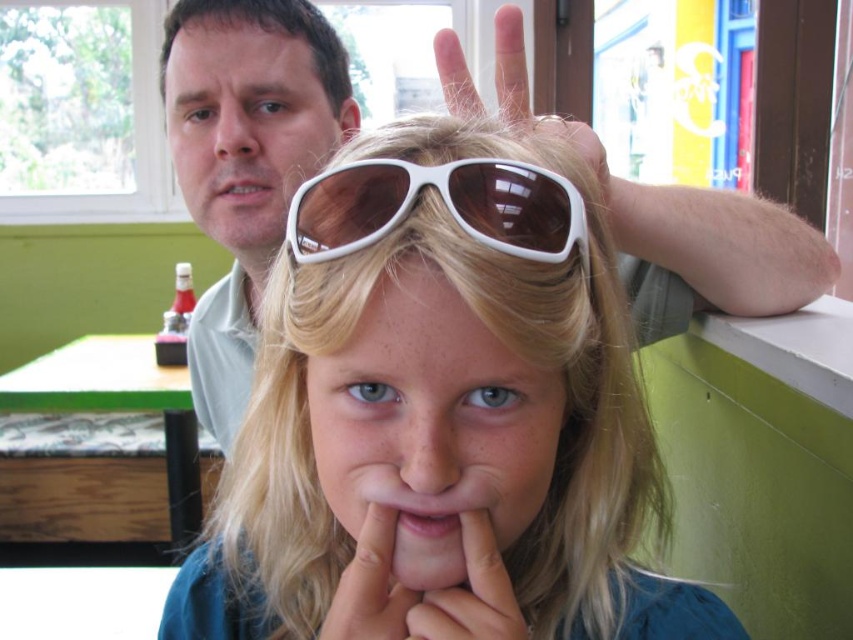
Question: Does white plastic sunglasses at center lie in front of matte skin nose at upper center?

Choices:
 (A) no
 (B) yes

Answer: (B)

Question: Is white matte hand at center wider than matte skin mouth at upper center?

Choices:
 (A) no
 (B) yes

Answer: (B)

Question: Does white matte hand at center appear under matte skin nose at upper center?

Choices:
 (A) no
 (B) yes

Answer: (B)

Question: Based on their relative distances, which object is farther from the smooth skin nose at center?

Choices:
 (A) matte skin nose at upper center
 (B) pink matte lips at center
 (C) white plastic sunglasses at center

Answer: (A)

Question: Based on their relative distances, which object is farther from the white matte sunglasses at center?

Choices:
 (A) smooth skin nose at center
 (B) white plastic sunglasses at center
 (C) matte skin mouth at upper center

Answer: (C)

Question: Which of the following is the farthest from the observer?

Choices:
 (A) pink matte lips at center
 (B) matte skin mouth at upper center
 (C) white matte sunglasses at center

Answer: (B)